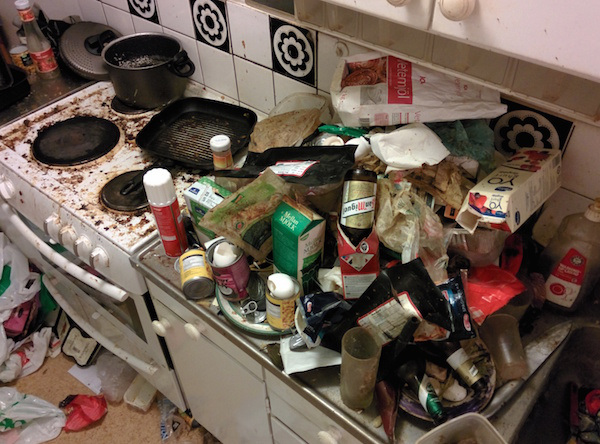
I want to click on cabinet knobs, so click(331, 435), click(190, 326), click(157, 324).